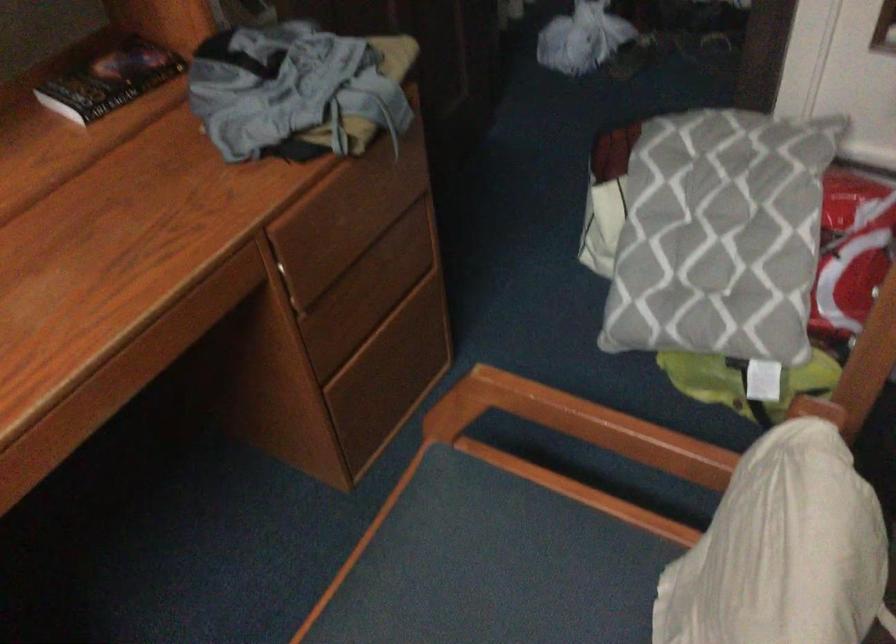
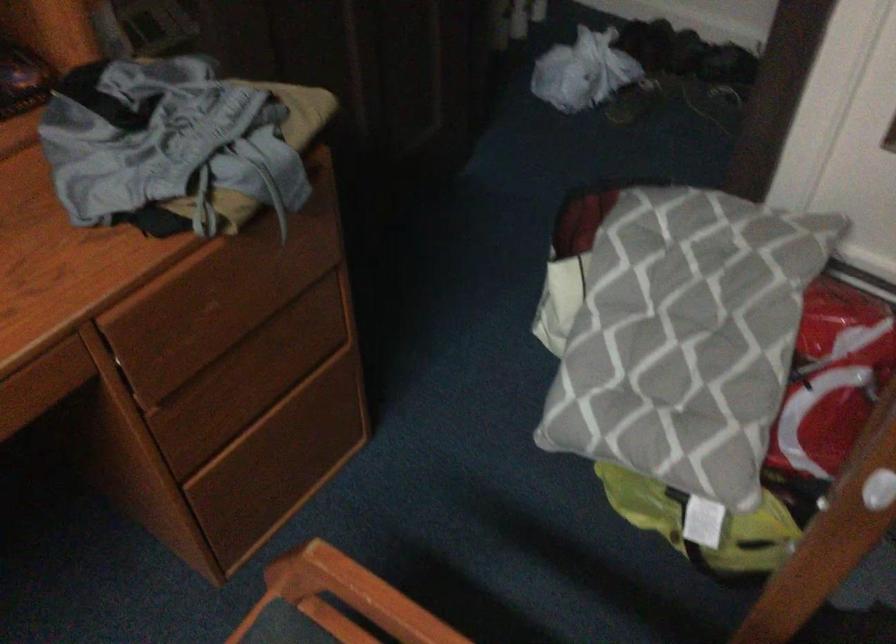
Locate, in the second image, the point that corresponds to (717,232) in the first image.

(677, 335)